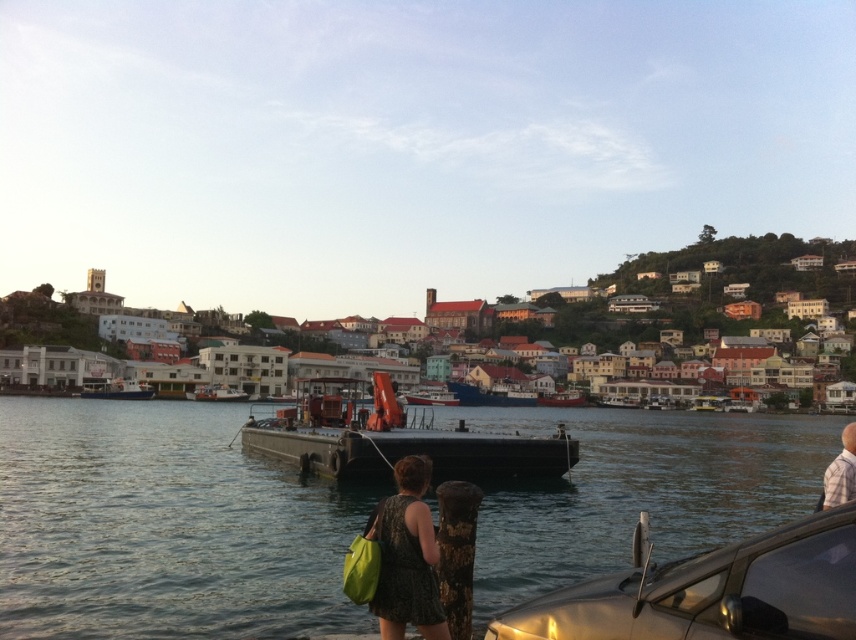
What do you see at coordinates (712, 593) in the screenshot?
I see `shiny silver car at lower right` at bounding box center [712, 593].

Where is `shiny silver car at lower right`? The height and width of the screenshot is (640, 856). shiny silver car at lower right is located at coordinates (712, 593).

Is point (849, 600) positioned after point (843, 474)?

No.

This screenshot has width=856, height=640. In order to click on shiny silver car at lower right in this screenshot , I will do `click(712, 593)`.

Does matte black dress at lower center appear on the left side of white shirt at lower right?

Correct, you'll find matte black dress at lower center to the left of white shirt at lower right.

Which is in front, point (408, 516) or point (854, 472)?

Point (408, 516)

You are a GUI agent. You are given a task and a screenshot of the screen. Output one action in this format:
    pyautogui.click(x=<x>, y=<y>)
    Task: Click on the matte black dress at lower center
    This screenshot has height=640, width=856.
    Given the screenshot: What is the action you would take?
    pyautogui.click(x=407, y=556)

Is point (831, 486) farther from camera compared to point (135, 385)?

No.

Can you confirm if white shirt at lower right is shorter than blue matte boat at left?

No, white shirt at lower right is not shorter than blue matte boat at left.

Measure the distance between point (848, 474) and camera.

The distance of point (848, 474) from camera is 49.66 meters.

Locate an element on the screen. The image size is (856, 640). white shirt at lower right is located at coordinates (841, 472).